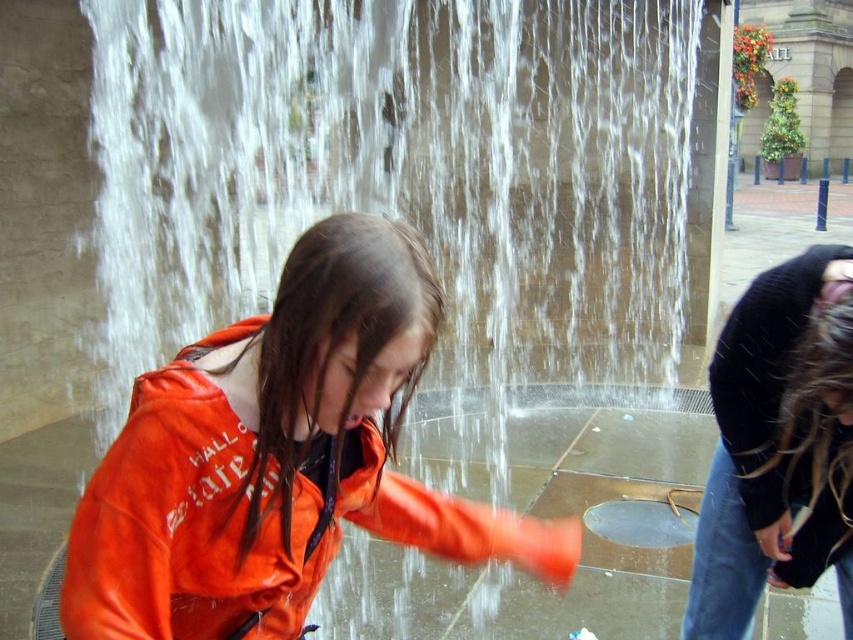
Question: Which point is closer to the camera?

Choices:
 (A) orange leather jacket at center
 (B) black sweater at lower right

Answer: (A)

Question: Does orange leather jacket at center appear over black sweater at lower right?

Choices:
 (A) yes
 (B) no

Answer: (A)

Question: In this image, where is orange leather jacket at center located relative to black sweater at lower right?

Choices:
 (A) right
 (B) left

Answer: (B)

Question: Which of the following is the farthest from the observer?

Choices:
 (A) black sweater at lower right
 (B) orange leather jacket at center

Answer: (A)

Question: Is orange leather jacket at center further to the viewer compared to black sweater at lower right?

Choices:
 (A) yes
 (B) no

Answer: (B)